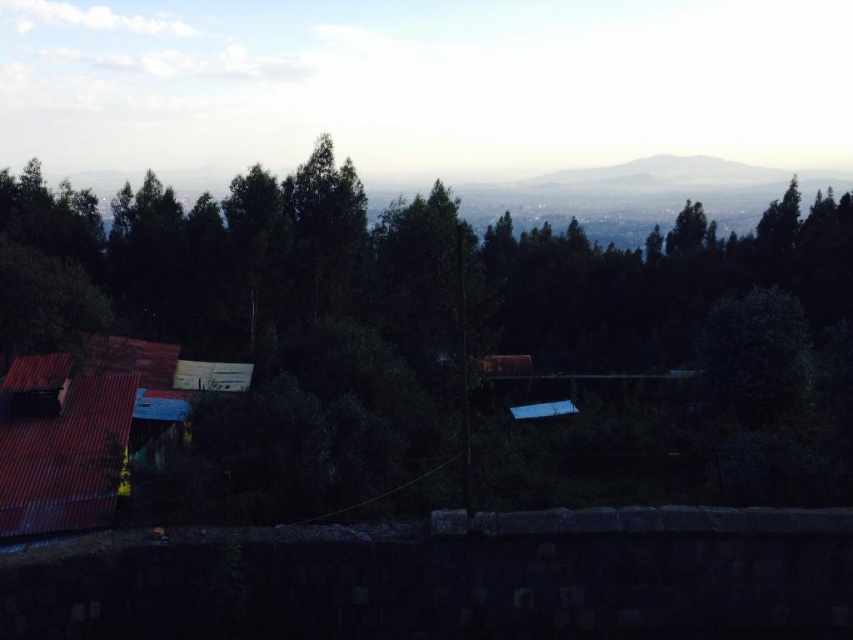
Who is taller, green leafy forest at center or rusty corrugated metal hut at lower left?

green leafy forest at center

Is green leafy forest at center smaller than rusty corrugated metal hut at lower left?

Actually, green leafy forest at center might be larger than rusty corrugated metal hut at lower left.

Measure the distance between green leafy forest at center and camera.

green leafy forest at center is 12.12 meters from camera.

You are a GUI agent. You are given a task and a screenshot of the screen. Output one action in this format:
    pyautogui.click(x=<x>, y=<y>)
    Task: Click on the green leafy forest at center
    The width and height of the screenshot is (853, 640).
    Given the screenshot: What is the action you would take?
    pyautogui.click(x=451, y=342)